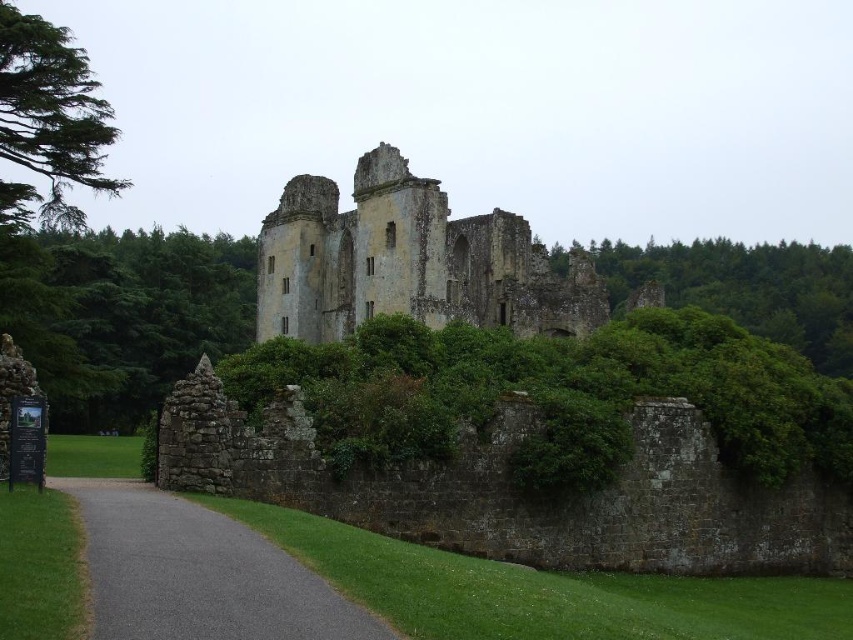
Question: Observing the image, what is the correct spatial positioning of weathered stone castle at center in reference to gray asphalt path at lower left?

Choices:
 (A) left
 (B) right

Answer: (B)

Question: Which of the following is the closest to the observer?

Choices:
 (A) (532, 298)
 (B) (289, 557)

Answer: (B)

Question: Among these objects, which one is nearest to the camera?

Choices:
 (A) gray asphalt path at lower left
 (B) weathered stone castle at center

Answer: (A)

Question: Can you confirm if weathered stone castle at center is positioned to the left of gray asphalt path at lower left?

Choices:
 (A) no
 (B) yes

Answer: (A)

Question: Does weathered stone castle at center have a smaller size compared to gray asphalt path at lower left?

Choices:
 (A) no
 (B) yes

Answer: (A)